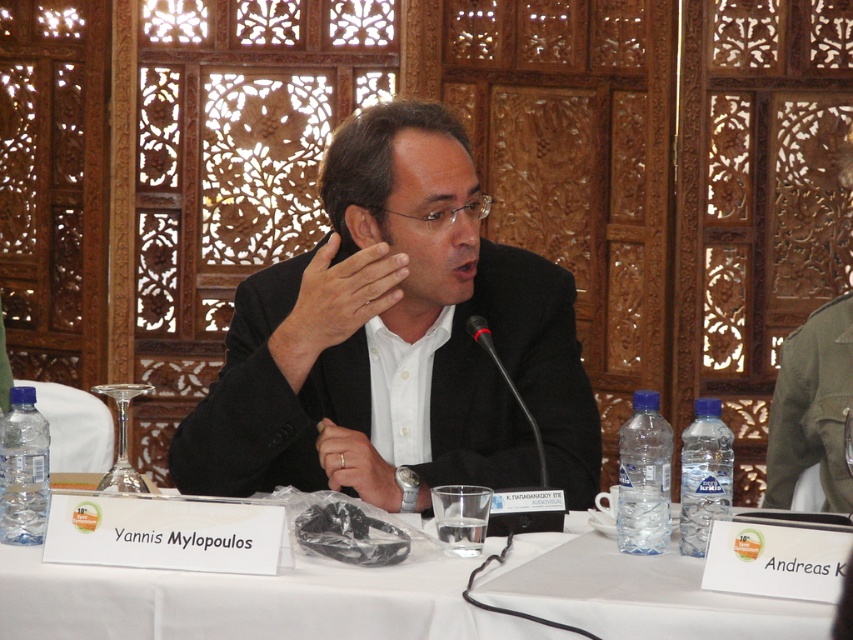
Is white cloth at center thinner than smooth skin hand at center?

No, white cloth at center is not thinner than smooth skin hand at center.

Which of these two, white cloth at center or smooth skin hand at center, stands shorter?

white cloth at center

Locate an element on the screen. Image resolution: width=853 pixels, height=640 pixels. white cloth at center is located at coordinates (247, 600).

Is black matte suit at center taller than smooth skin hand at center?

No, black matte suit at center is not taller than smooth skin hand at center.

Is black matte suit at center to the right of smooth skin hand at center from the viewer's perspective?

→ Correct, you'll find black matte suit at center to the right of smooth skin hand at center.

Does point (579, 410) come closer to viewer compared to point (354, 321)?

No, (579, 410) is further to viewer.

You are a GUI agent. You are given a task and a screenshot of the screen. Output one action in this format:
    pyautogui.click(x=<x>, y=<y>)
    Task: Click on the black matte suit at center
    This screenshot has width=853, height=640.
    Given the screenshot: What is the action you would take?
    pyautogui.click(x=396, y=330)

Can you confirm if black matte suit at center is positioned to the left of white cloth at center?

Yes, black matte suit at center is to the left of white cloth at center.

Between black matte suit at center and white cloth at center, which one is positioned higher?

Positioned higher is black matte suit at center.

The height and width of the screenshot is (640, 853). In order to click on black matte suit at center in this screenshot , I will do `click(396, 330)`.